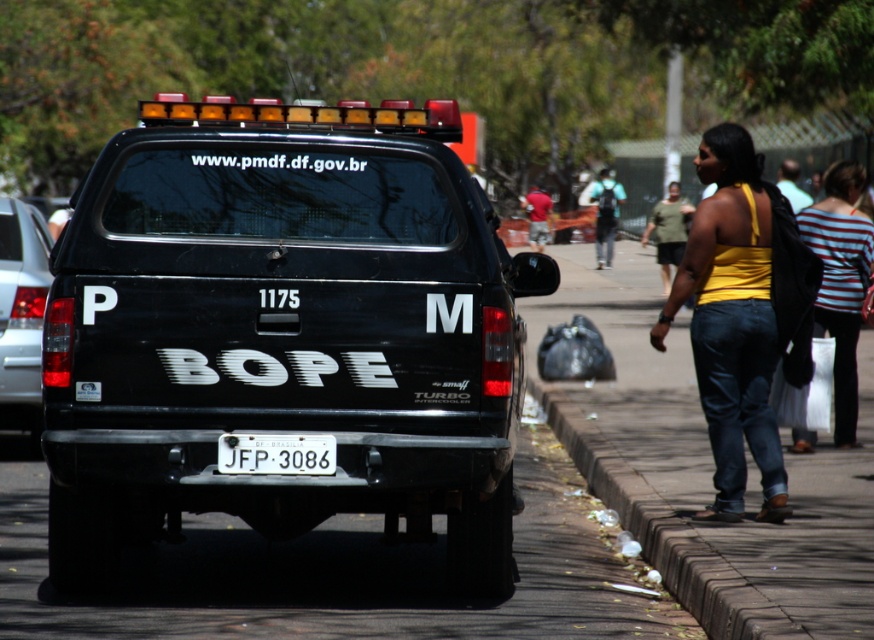
Is black matte truck at center smaller than black matte truck at left?

Yes, black matte truck at center is smaller than black matte truck at left.

You are a GUI agent. You are given a task and a screenshot of the screen. Output one action in this format:
    pyautogui.click(x=<x>, y=<y>)
    Task: Click on the black matte truck at center
    This screenshot has width=874, height=640.
    Given the screenshot: What is the action you would take?
    pyautogui.click(x=283, y=332)

Locate an element on the screen. This screenshot has height=640, width=874. black matte truck at center is located at coordinates (283, 332).

Is striped cotton shirt at center in front of white plastic license plate at center?

No, striped cotton shirt at center is behind white plastic license plate at center.

Between striped cotton shirt at center and white plastic license plate at center, which one appears on the left side from the viewer's perspective?

white plastic license plate at center

You are a GUI agent. You are given a task and a screenshot of the screen. Output one action in this format:
    pyautogui.click(x=<x>, y=<y>)
    Task: Click on the striped cotton shirt at center
    The height and width of the screenshot is (640, 874).
    Given the screenshot: What is the action you would take?
    [841, 280]

Does point (774, 605) come farther from viewer compared to point (702, 144)?

That is False.

The height and width of the screenshot is (640, 874). Describe the element at coordinates (705, 468) in the screenshot. I see `smooth concrete sidewalk at lower right` at that location.

This screenshot has height=640, width=874. I want to click on smooth concrete sidewalk at lower right, so click(705, 468).